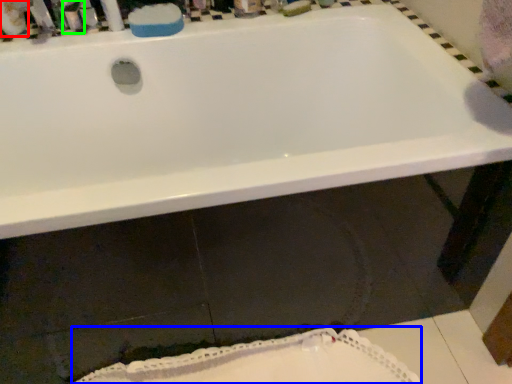
Question: Which object is positioned closest to mouthwash (highlighted by a red box)? Select from bath mat (highlighted by a blue box) and toiletry (highlighted by a green box).

Choices:
 (A) bath mat
 (B) toiletry

Answer: (B)